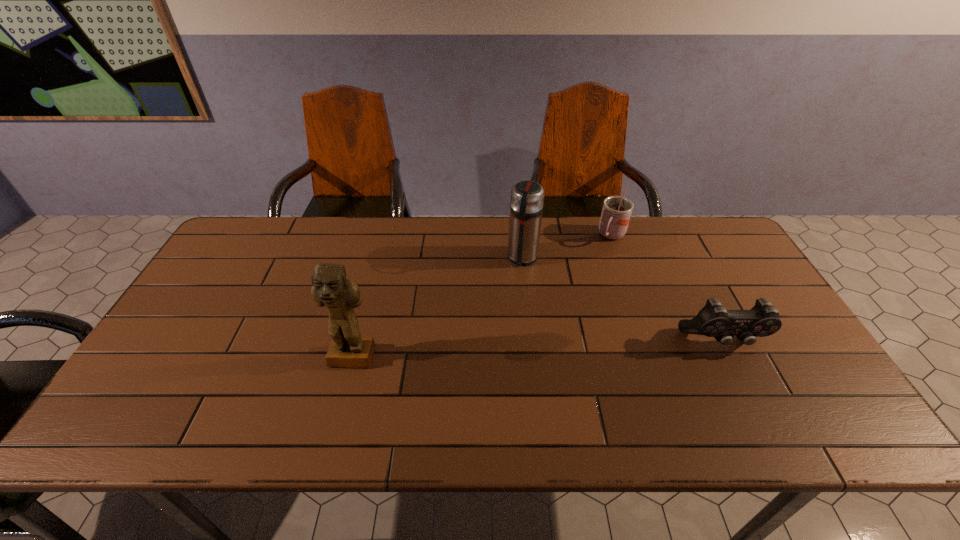
This screenshot has width=960, height=540. I want to click on the leftmost object, so click(x=330, y=287).

Image resolution: width=960 pixels, height=540 pixels. What are the coordinates of `figurine` in the screenshot? It's located at (330, 287).

This screenshot has width=960, height=540. What are the coordinates of `the rightmost object` in the screenshot? It's located at (713, 320).

The height and width of the screenshot is (540, 960). In order to click on cup in this screenshot , I will do `click(616, 212)`.

You are a GUI agent. You are given a task and a screenshot of the screen. Output one action in this format:
    pyautogui.click(x=<x>, y=<y>)
    Task: Click on the thermos bottle
    This screenshot has width=960, height=540.
    Given the screenshot: What is the action you would take?
    pyautogui.click(x=526, y=202)

Find the location of a particular element. the second object from left to right is located at coordinates (526, 202).

Where is `vacant space located on the front-facing side of the tallest object`? This screenshot has width=960, height=540. vacant space located on the front-facing side of the tallest object is located at coordinates (344, 391).

Find the location of `blank space located 0.110m on the surface of the control with buttons`. blank space located 0.110m on the surface of the control with buttons is located at coordinates (751, 394).

In order to click on free location located on the side with the handle of the second object from right to left in this screenshot , I will do `click(569, 301)`.

Locate an element on the screen. This screenshot has width=960, height=540. vacant point located on the side with the handle of the second object from right to left is located at coordinates (x=593, y=266).